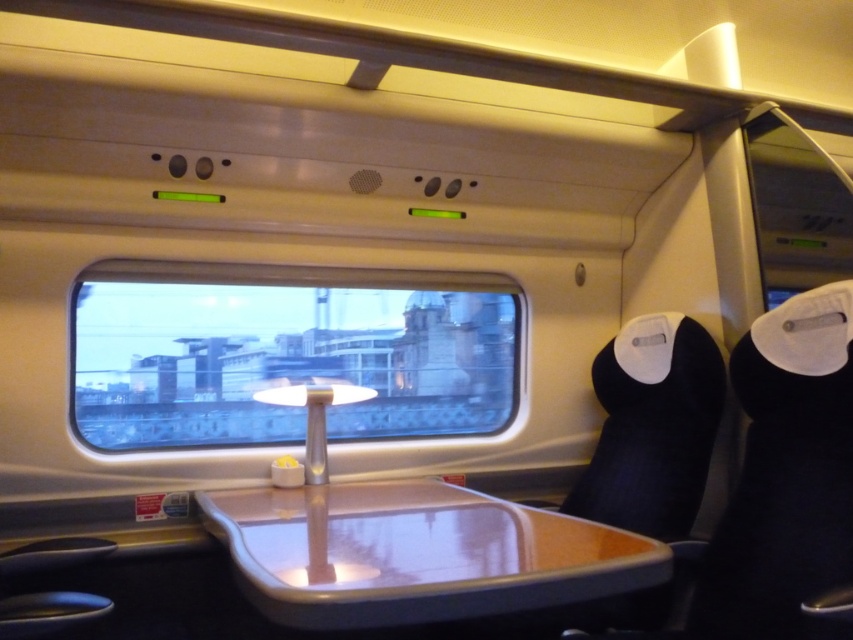
Question: In this image, where is transparent glass window at center located relative to matte plastic tray at center?

Choices:
 (A) left
 (B) right

Answer: (A)

Question: Which of the following is the farthest from the observer?

Choices:
 (A) (277, 593)
 (B) (244, 401)

Answer: (B)

Question: Can you confirm if transparent glass window at center is positioned to the right of matte plastic tray at center?

Choices:
 (A) no
 (B) yes

Answer: (A)

Question: Is transparent glass window at center above matte plastic tray at center?

Choices:
 (A) no
 (B) yes

Answer: (B)